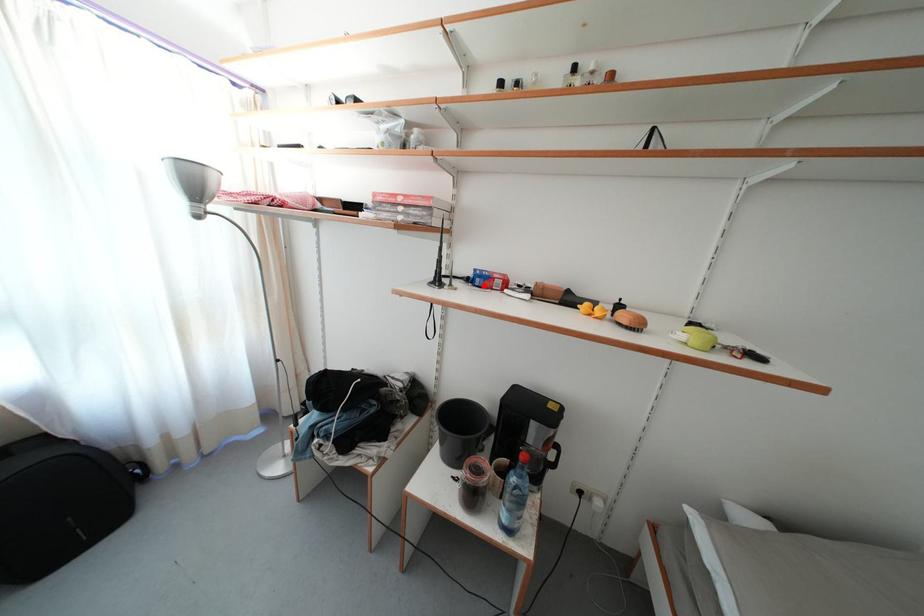
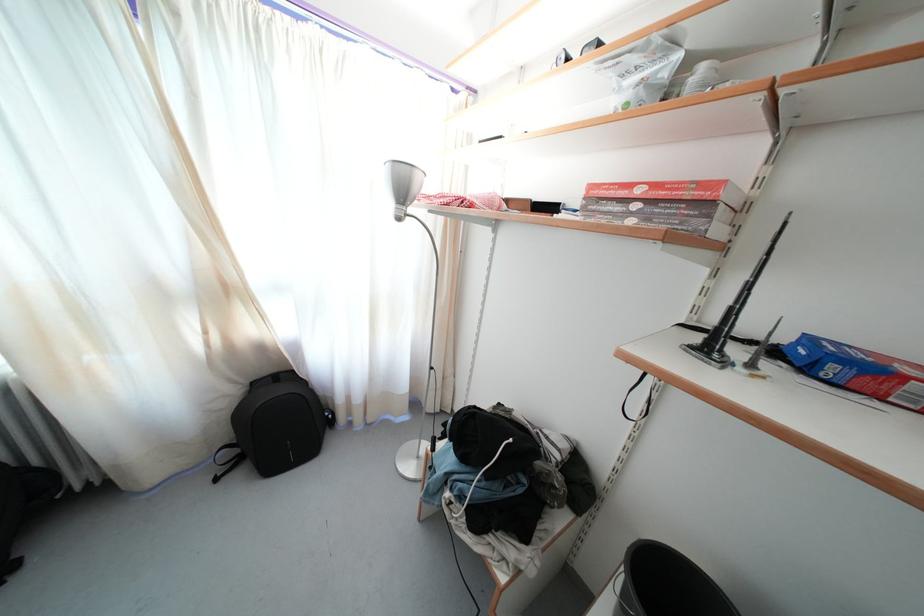
In the second image, find the point that corresponds to the highlighted location in the first image.

(839, 374)